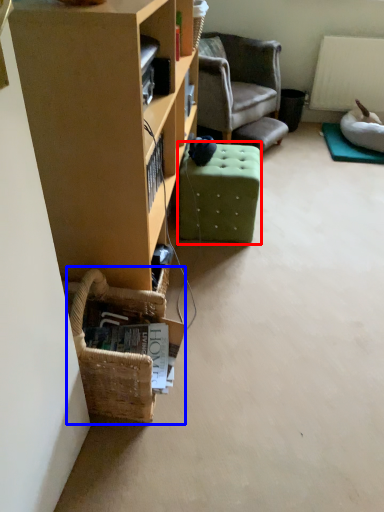
Question: Which of the following is the farthest to the observer, stool (highlighted by a red box) or basket (highlighted by a blue box)?

Choices:
 (A) stool
 (B) basket

Answer: (A)